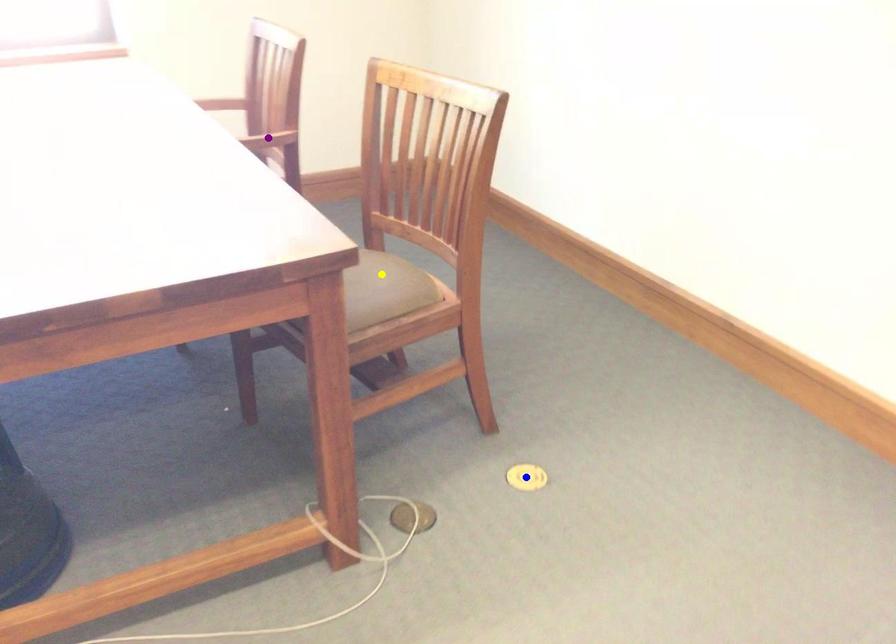
Order these from farthest to nearest:
A) blue point
B) yellow point
C) purple point

purple point → blue point → yellow point